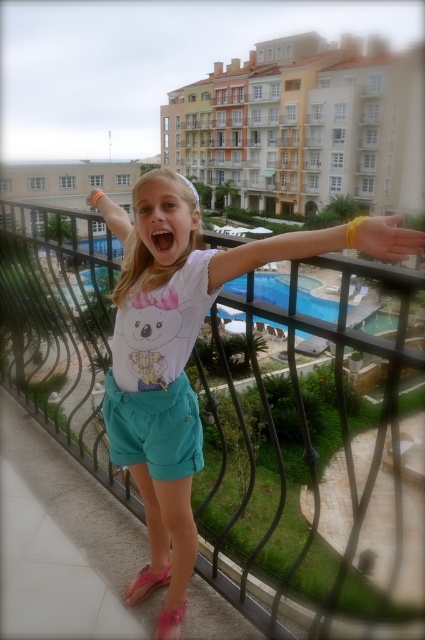
You are a photographer trying to capture the blue glass pool at center and the pink fabric sandal at lower center in the same frame. Based on their positions, which object is closer to the camera?

The pink fabric sandal at lower center is closer to the camera because the blue glass pool at center is positioned over it, indicating it is further away.

The young girl is standing on a balcony with two pink sandals at her feet. Which sandal is closer to the edge of the balcony? The pink fabric sandal at lower center or the pink satin sandal at lower center?

The pink fabric sandal at lower center is closer to the edge of the balcony because the pink satin sandal at lower center is positioned behind it.

You are standing on the balcony and want to throw a ball from the point at coordinates point (272,284) to the point at coordinates point (149,566). Will the ball need to be thrown upwards or downwards to reach the second point?

The ball will need to be thrown downwards because point (272,284) is further to the camera than point (149,566), meaning the second point is closer to the viewer and lower in position.